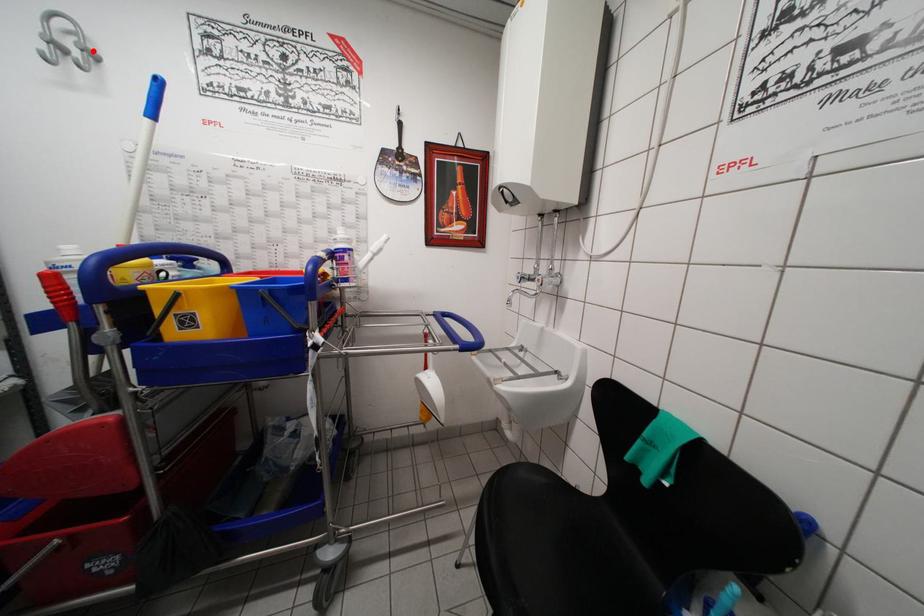
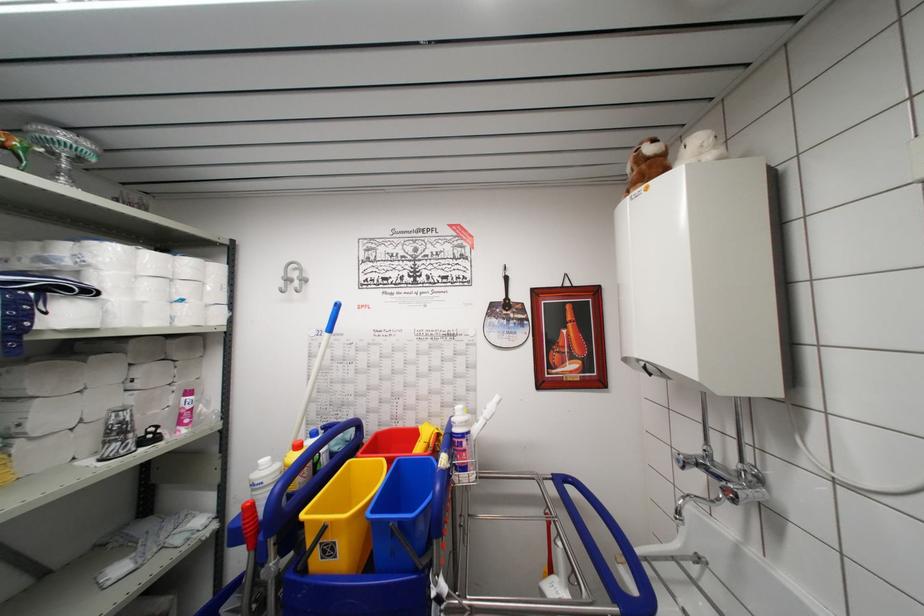
Question: I am providing you with two images of the same scene from different viewpoints. In image1, a red point is highlighted. Considering the same 3D point in image2, which of the following is correct?

Choices:
 (A) It is closer
 (B) It is farther

Answer: (A)